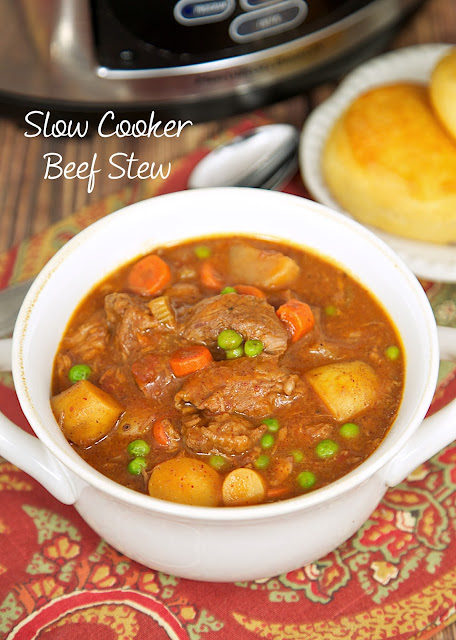
What are the coordinates of `handle` in the screenshot? It's located at (431, 432).